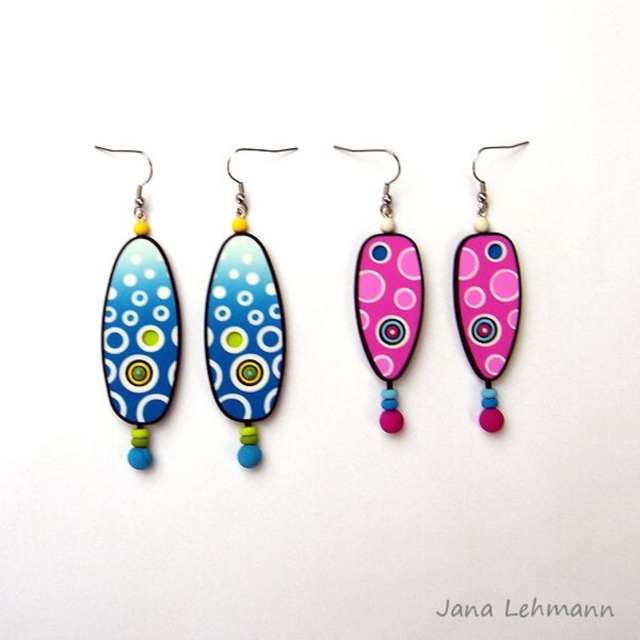
Question: Does pink glossy earring at center appear on the left side of pink glossy teardrop at center?

Choices:
 (A) no
 (B) yes

Answer: (B)

Question: Considering the real-world distances, which object is closest to the matte blue polymer clay earring at left?

Choices:
 (A) pink glossy teardrop at center
 (B) blue glossy oval at center
 (C) pink glossy earring at center

Answer: (B)

Question: Which of the following is the farthest from the observer?

Choices:
 (A) pink glossy teardrop at center
 (B) blue glossy oval at center

Answer: (A)

Question: Can you confirm if blue glossy oval at center is positioned below pink glossy earring at center?

Choices:
 (A) no
 (B) yes

Answer: (B)

Question: Does pink glossy earring at center appear under pink glossy teardrop at center?

Choices:
 (A) yes
 (B) no

Answer: (B)

Question: Which point appears farthest from the camera in this image?

Choices:
 (A) (371, 324)
 (B) (465, 248)
 (C) (144, 452)
 (D) (248, 300)

Answer: (A)